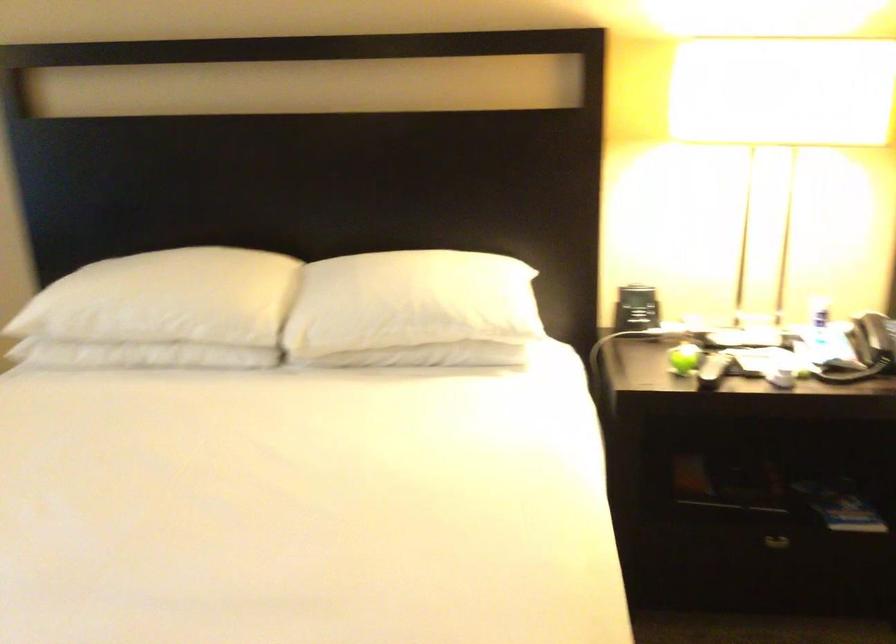
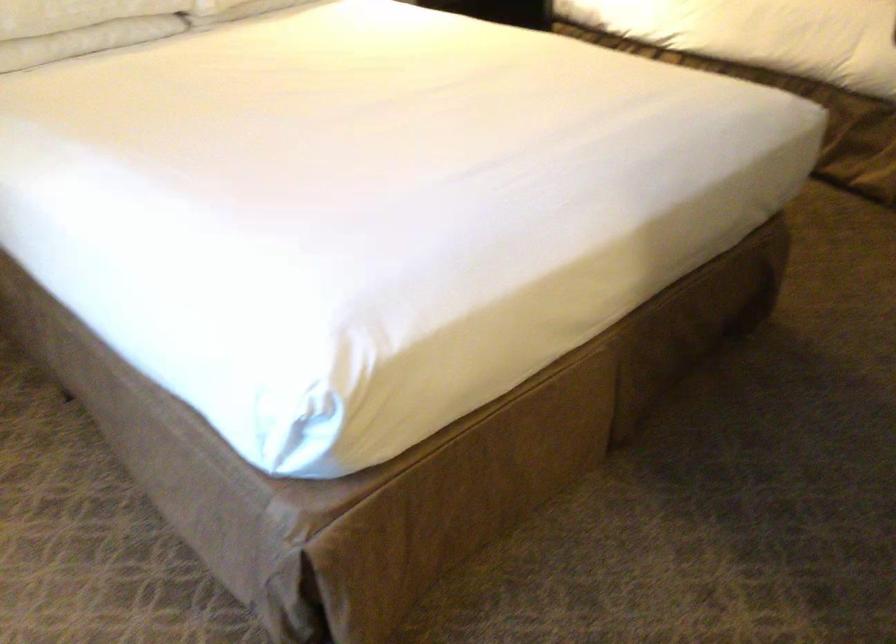
Locate, in the second image, the point that corresponds to point 148,343 in the first image.

(81, 26)